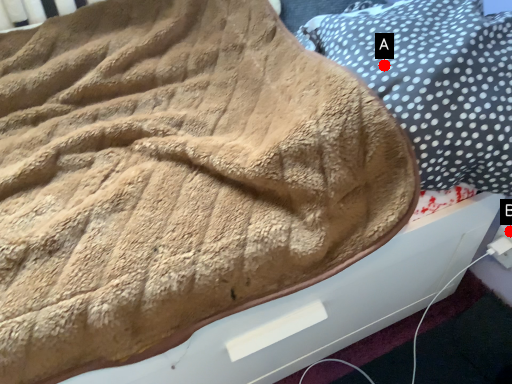
Question: Two points are circled on the image, labeled by A and B beside each circle. Which point is closer to the camera taking this photo?

Choices:
 (A) A is closer
 (B) B is closer

Answer: (A)